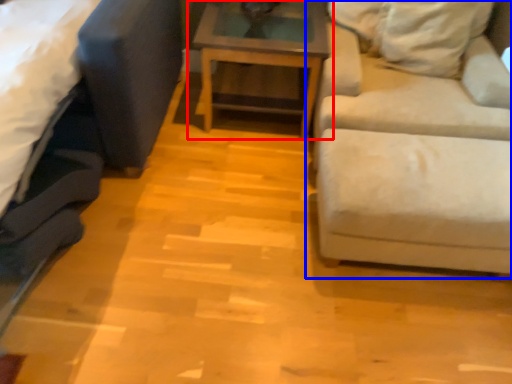
Question: Among these objects, which one is farthest to the camera, table (highlighted by a red box) or studio couch (highlighted by a blue box)?

Choices:
 (A) table
 (B) studio couch

Answer: (A)